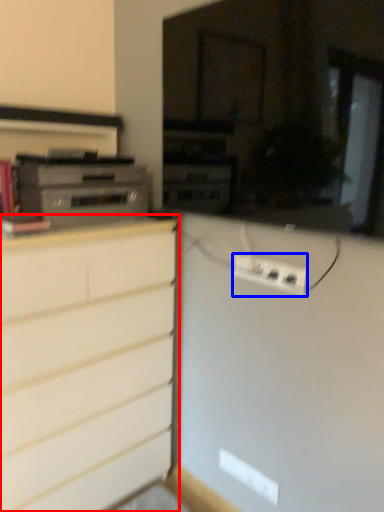
Question: Which point is closer to the camera, chest of drawers (highlighted by a red box) or electric outlet (highlighted by a blue box)?

Choices:
 (A) chest of drawers
 (B) electric outlet

Answer: (A)